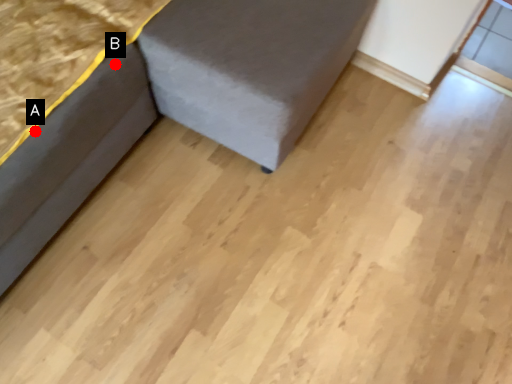
Question: Two points are circled on the image, labeled by A and B beside each circle. Which of the following is the farthest from the observer?

Choices:
 (A) A is further
 (B) B is further

Answer: (B)